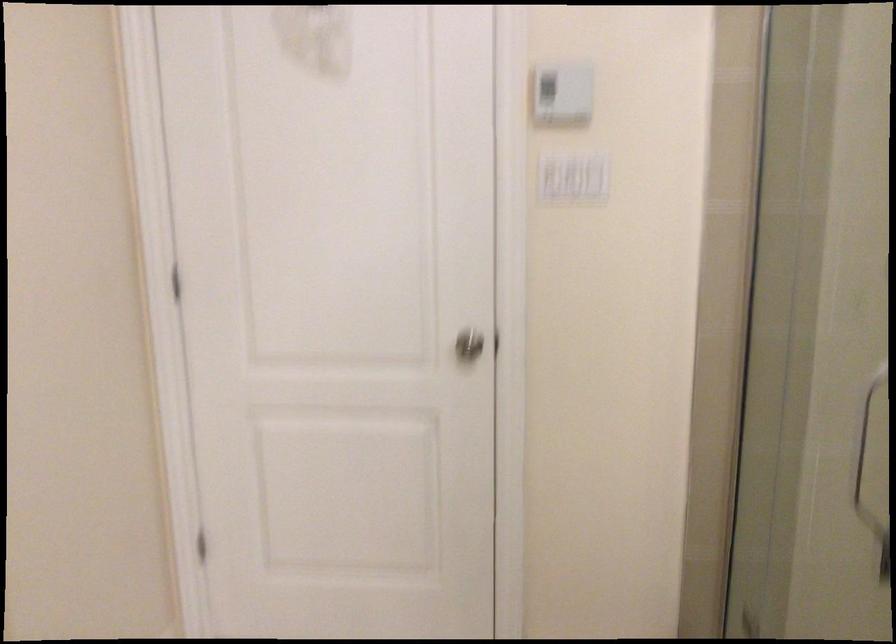
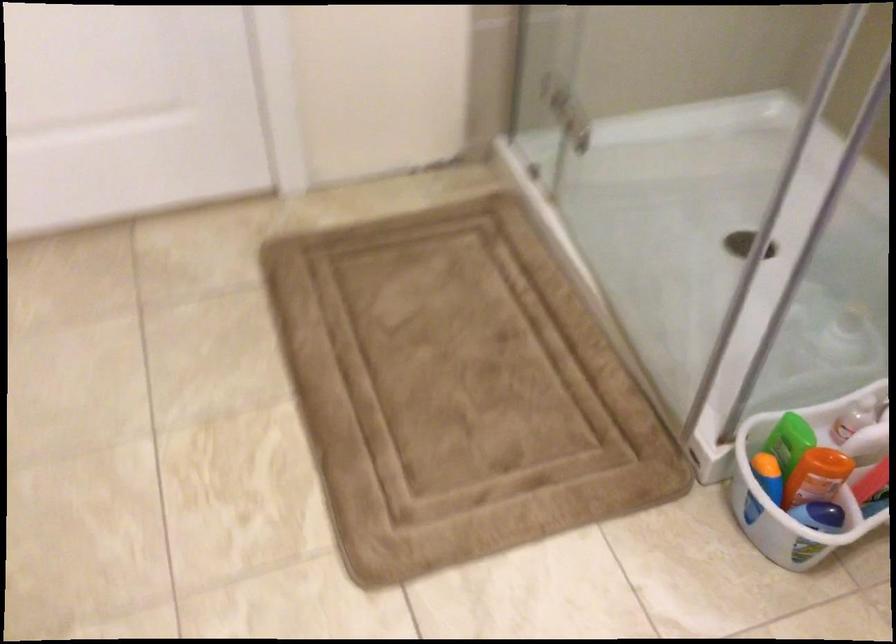
How did the camera likely rotate?

The rotation direction of the camera is right-down.